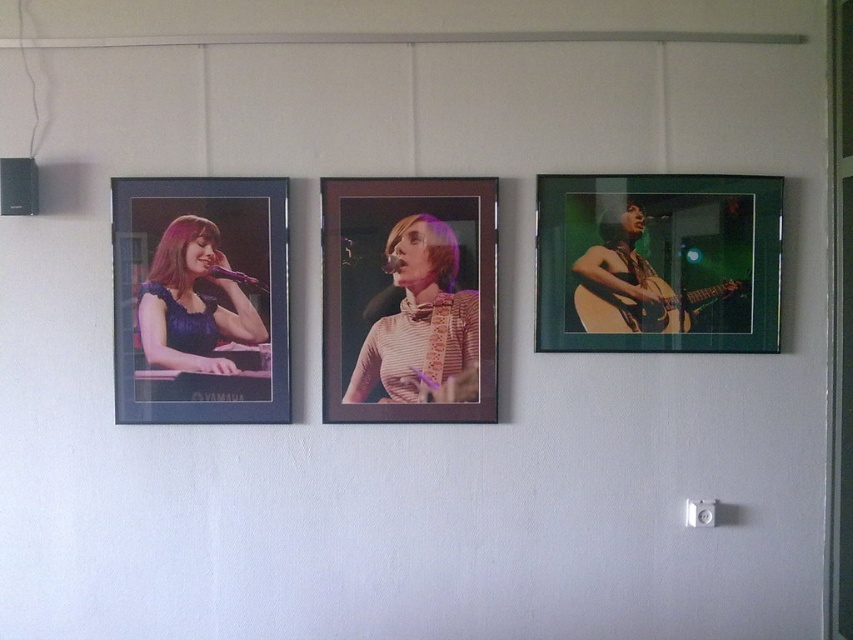
Is the position of green matte picture frame at right less distant than that of matte black frame at left?

That is False.

In order to click on green matte picture frame at right in this screenshot , I will do `click(659, 262)`.

Image resolution: width=853 pixels, height=640 pixels. Find the location of `green matte picture frame at right`. green matte picture frame at right is located at coordinates (659, 262).

Can you confirm if green matte picture frame at right is positioned to the left of matte purple dress at left?

No, green matte picture frame at right is not to the left of matte purple dress at left.

Who is shorter, green matte picture frame at right or matte purple dress at left?

Standing shorter between the two is matte purple dress at left.

Does point (753, 266) come closer to viewer compared to point (146, 285)?

No, it is behind (146, 285).

You are a GUI agent. You are given a task and a screenshot of the screen. Output one action in this format:
    pyautogui.click(x=<x>, y=<y>)
    Task: Click on the green matte picture frame at right
    The image size is (853, 640).
    Given the screenshot: What is the action you would take?
    pyautogui.click(x=659, y=262)

Is matte black frame at left wider than acoustic wood guitar at right?

Correct, the width of matte black frame at left exceeds that of acoustic wood guitar at right.

Looking at this image, who is more distant from viewer, (271, 180) or (593, 301)?

The point (593, 301) is more distant.

Where is `matte black frame at left`? The height and width of the screenshot is (640, 853). matte black frame at left is located at coordinates (200, 300).